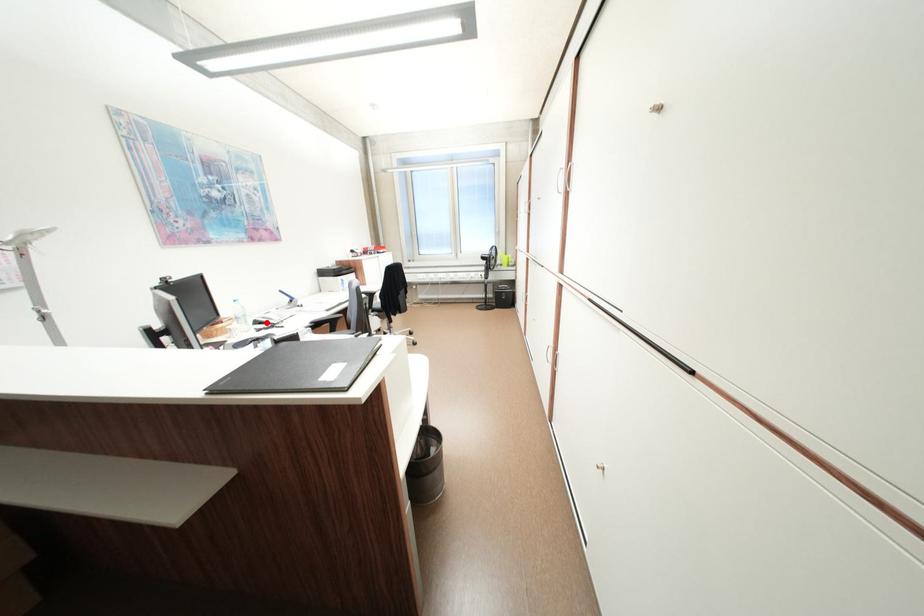
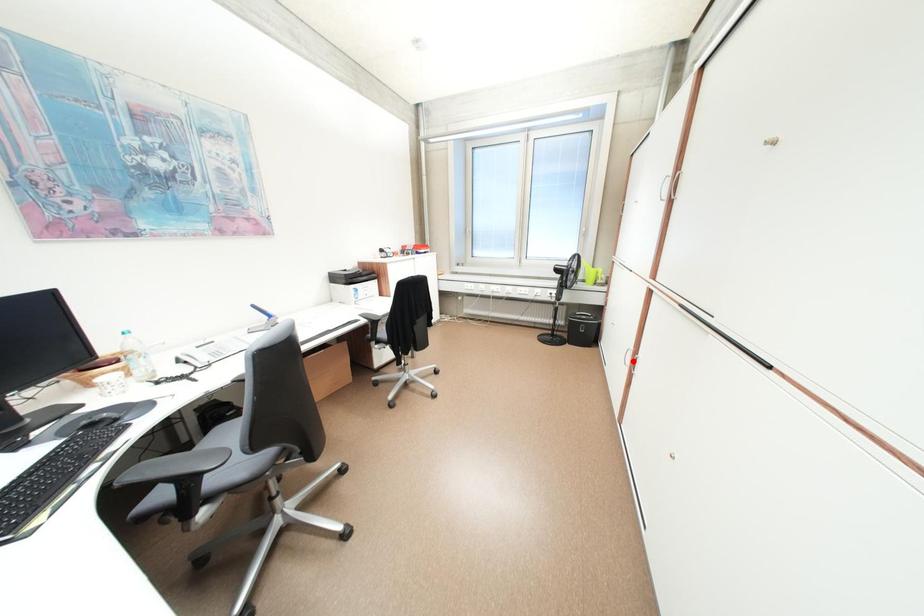
I am providing you with two images of the same scene from different viewpoints. A red point is marked on the first image and another point is marked on the second image. Do the highlighted points in image1 and image2 indicate the same real-world spot?

No